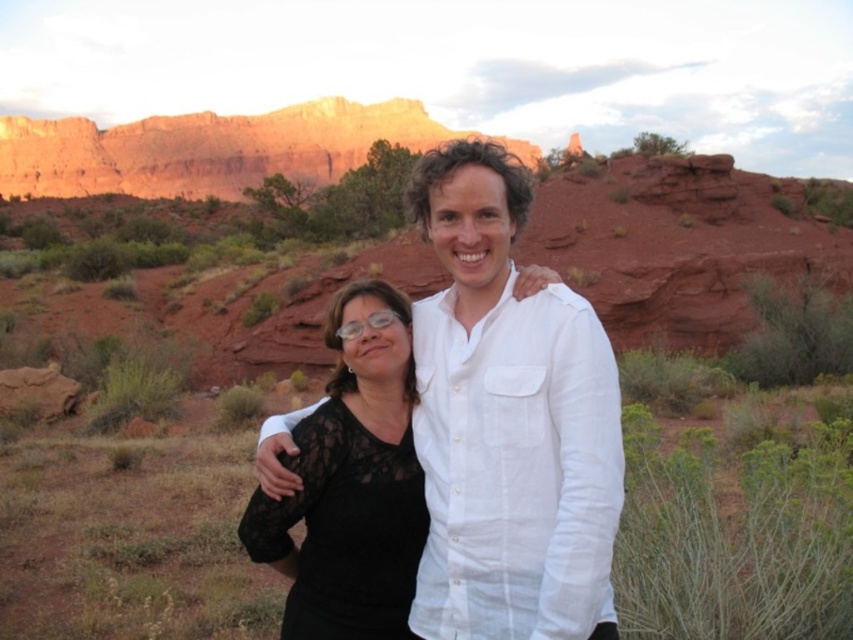
You are standing in the desert scene and want to take a photo of the black lace dress at center. You notice a point at coordinates (508, 422). Is this point located on the black lace dress at center?

Yes, the point at coordinates (508, 422) is located on the black lace dress at center, as stated in the description.

You are a photographer trying to capture the best shot of the two people in the image. Since you want to highlight the black lace dress at center and the black lace top at center, which one should you focus on if you want to emphasize the taller item?

The black lace dress at center is taller than the black lace top at center, so focusing on the black lace dress at center would emphasize the taller item.

You are a photographer trying to capture a detailed shot of the black lace dress at center. Based on the scene description, where should you focus your camera to ensure the dress is in the frame?

You should focus your camera at point (508, 422) to capture the black lace dress at center.